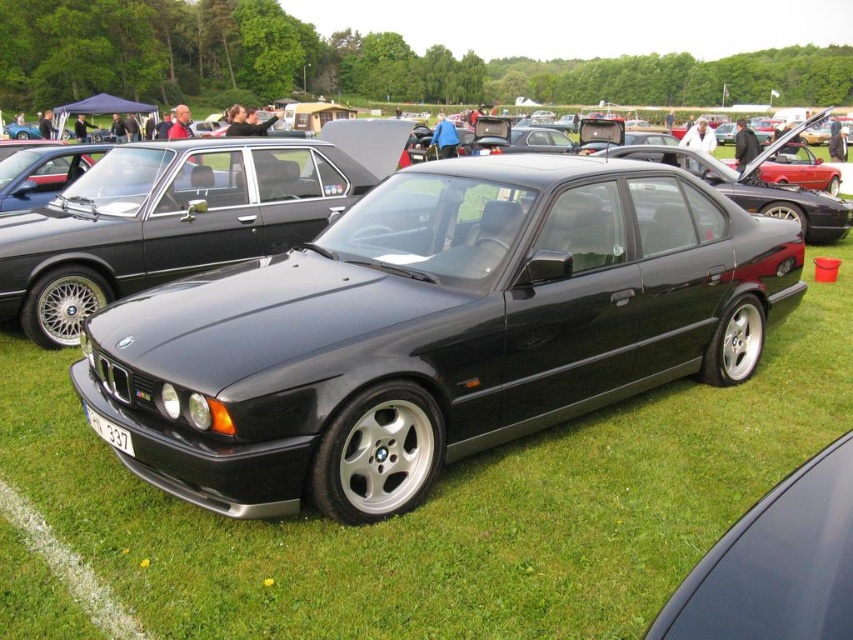
Is black metallic sedan at center taller than white plastic license plate at lower center?

Yes, black metallic sedan at center is taller than white plastic license plate at lower center.

Which is below, black metallic sedan at center or white plastic license plate at lower center?

white plastic license plate at lower center

This screenshot has width=853, height=640. In order to click on black metallic sedan at center in this screenshot , I will do `click(178, 216)`.